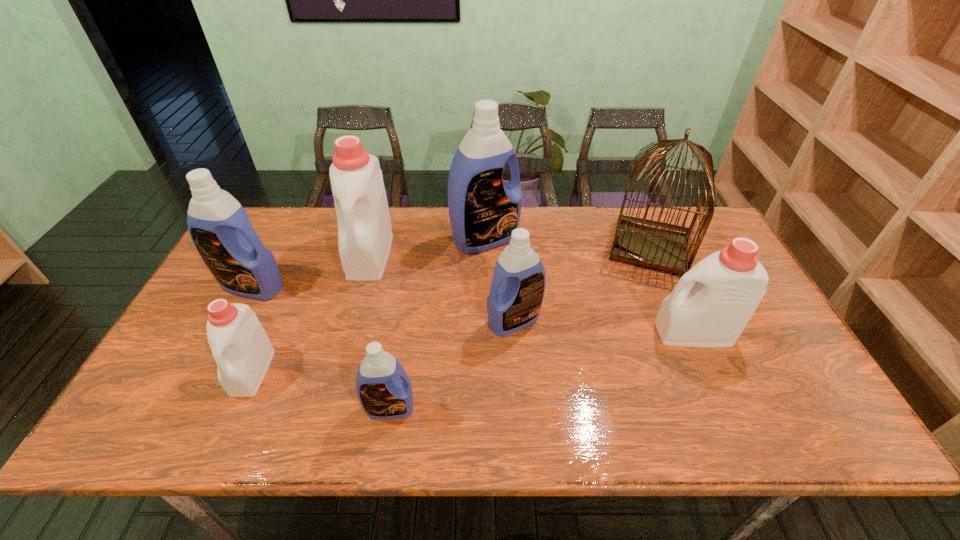
The image size is (960, 540). I want to click on the tallest detergent, so click(x=483, y=210).

Image resolution: width=960 pixels, height=540 pixels. What are the coordinates of `the farthest blue detergent` in the screenshot? It's located at (483, 210).

Image resolution: width=960 pixels, height=540 pixels. Find the location of `birdcage`. birdcage is located at coordinates (655, 245).

I want to click on the second biggest blue detergent, so click(x=219, y=226).

Identify the location of the second farthest blue detergent. The height and width of the screenshot is (540, 960). (219, 226).

You are a GUI agent. You are given a task and a screenshot of the screen. Output one action in this format:
    pyautogui.click(x=<x>, y=<y>)
    Task: Click on the biggest white detergent
    
    Given the screenshot: What is the action you would take?
    pyautogui.click(x=364, y=226)

In order to click on the second white detergent from right to left in this screenshot , I will do `click(364, 226)`.

This screenshot has height=540, width=960. What are the coordinates of `the third farthest blue detergent` in the screenshot? It's located at (516, 294).

Identify the location of the rightmost detergent. This screenshot has width=960, height=540. (725, 288).

Find the location of `the second biggest white detergent`. the second biggest white detergent is located at coordinates (725, 288).